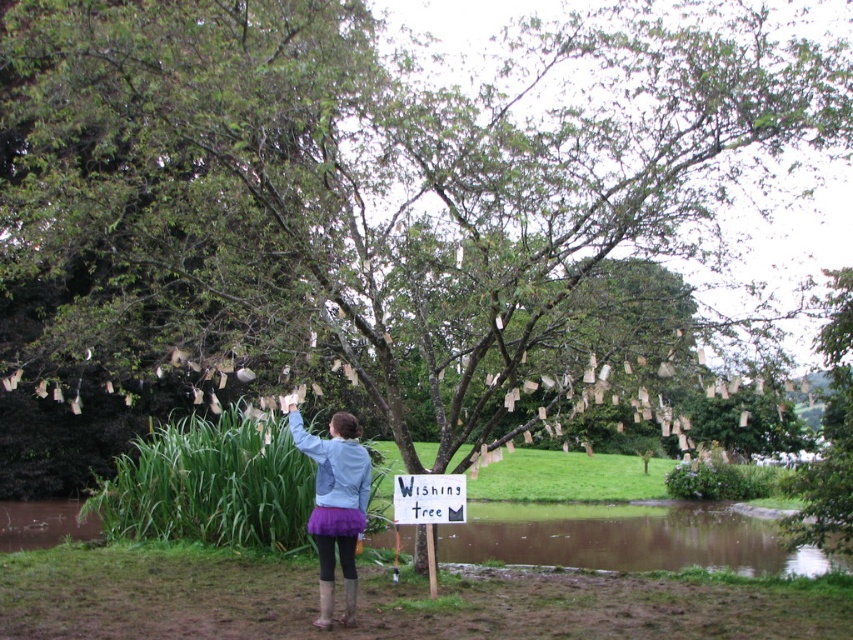
Question: Which object appears closest to the camera in this image?

Choices:
 (A) purple tulle skirt at center
 (B) white paper sign at center

Answer: (A)

Question: Which point is closer to the camera?

Choices:
 (A) white paper sign at center
 (B) purple tulle skirt at center

Answer: (B)

Question: Can you confirm if purple tulle skirt at center is positioned above white paper sign at center?

Choices:
 (A) no
 (B) yes

Answer: (B)

Question: Can you confirm if purple tulle skirt at center is positioned above white paper sign at center?

Choices:
 (A) yes
 (B) no

Answer: (A)

Question: Which object is closer to the camera taking this photo?

Choices:
 (A) white paper sign at center
 (B) purple tulle skirt at center

Answer: (B)

Question: Does purple tulle skirt at center come in front of white paper sign at center?

Choices:
 (A) no
 (B) yes

Answer: (B)